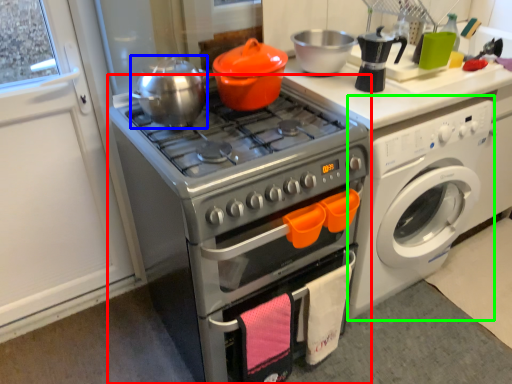
Question: Based on their relative distances, which object is nearer to oven (highlighted by a red box)? Choose from tea pot (highlighted by a blue box) and washing machine (highlighted by a green box).

Choices:
 (A) tea pot
 (B) washing machine

Answer: (A)